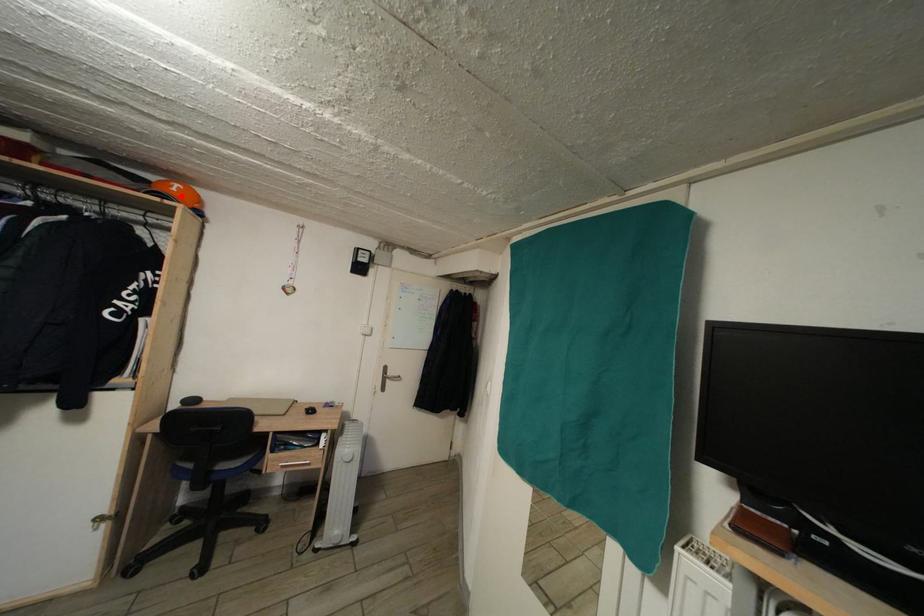
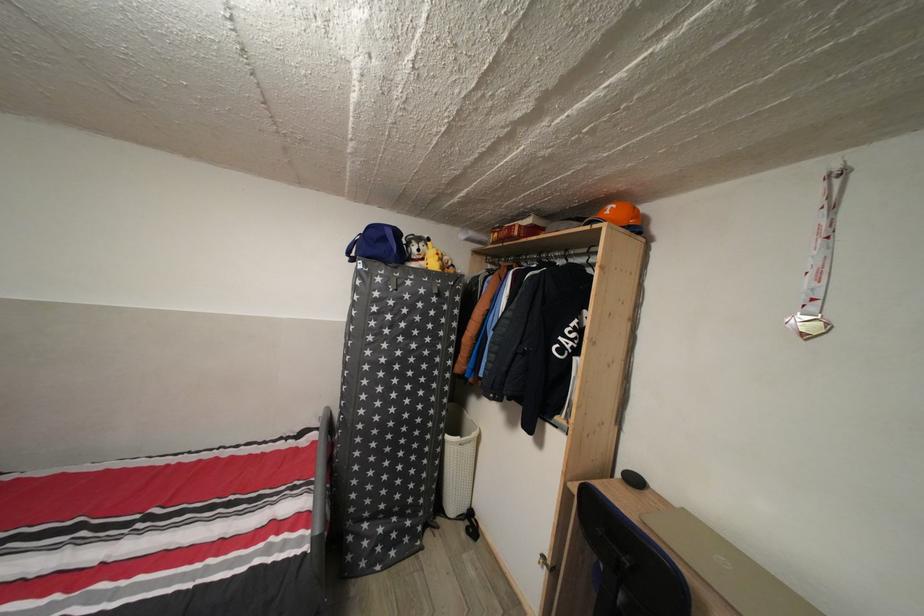
Question: I am providing you with two images of the same scene from different viewpoints. A red point is marked on the first image. At the location where the point appears in image 1, is it still visible in image 2?

Choices:
 (A) Yes
 (B) No

Answer: (A)